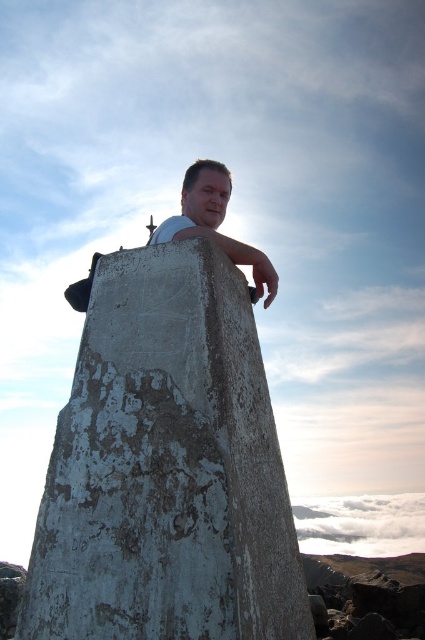
Question: Which of the following is the farthest from the observer?

Choices:
 (A) matte concrete man at center
 (B) weathered concrete pillar at center

Answer: (A)

Question: Can you confirm if weathered concrete pillar at center is positioned above matte concrete man at center?

Choices:
 (A) no
 (B) yes

Answer: (A)

Question: Can you confirm if weathered concrete pillar at center is thinner than matte concrete man at center?

Choices:
 (A) yes
 (B) no

Answer: (B)

Question: Does weathered concrete pillar at center have a lesser width compared to matte concrete man at center?

Choices:
 (A) no
 (B) yes

Answer: (A)

Question: Which of the following is the closest to the observer?

Choices:
 (A) 197,173
 (B) 150,564

Answer: (B)